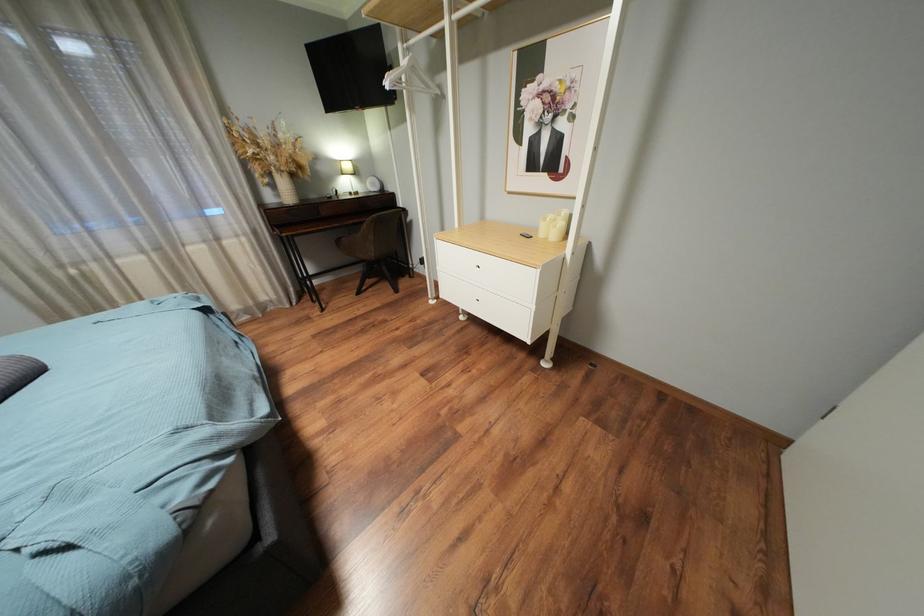
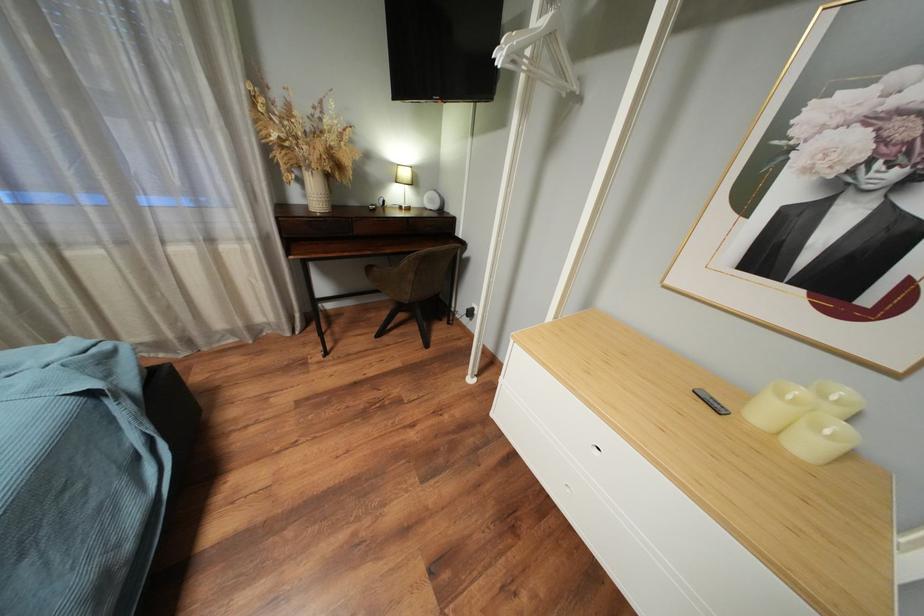
Question: How did the camera likely rotate?

Choices:
 (A) Left
 (B) Right
 (C) Up
 (D) Down

Answer: (A)